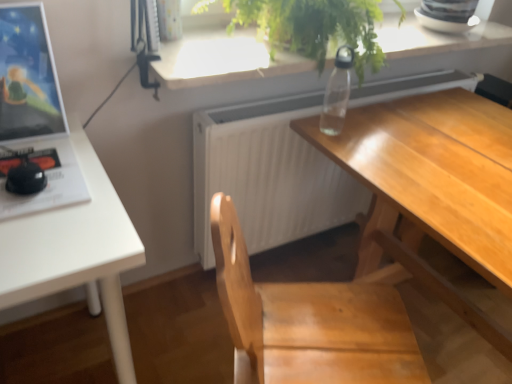
Locate an element on the screen. Image resolution: width=512 pixels, height=384 pixels. matte black monitor at left is located at coordinates tap(28, 76).

The width and height of the screenshot is (512, 384). What do you see at coordinates (28, 76) in the screenshot? I see `matte black monitor at left` at bounding box center [28, 76].

The height and width of the screenshot is (384, 512). What do you see at coordinates (337, 93) in the screenshot?
I see `transparent plastic bottle at upper center` at bounding box center [337, 93].

Where is `white matte radiator at center`? The height and width of the screenshot is (384, 512). white matte radiator at center is located at coordinates (268, 174).

Where is `green leafy plant at upper center`? The image size is (512, 384). green leafy plant at upper center is located at coordinates (314, 27).

Image resolution: width=512 pixels, height=384 pixels. I want to click on matte black monitor at left, so click(28, 76).

Can you confirm if matte black monitor at left is wider than white matte radiator at center?

Incorrect, the width of matte black monitor at left does not surpass that of white matte radiator at center.

How many degrees apart are the facing directions of matte black monitor at left and white matte radiator at center?

The angular difference between matte black monitor at left and white matte radiator at center is 3.69 degrees.

From the image's perspective, is matte black monitor at left positioned above or below white matte radiator at center?

Based on their image positions, matte black monitor at left is located above white matte radiator at center.

Does point (37, 92) appear closer or farther from the camera than point (266, 192)?

Point (37, 92).

Relative to green leafy plant at upper center, is white matte radiator at center in front or behind?

In the image, white matte radiator at center appears behind green leafy plant at upper center.

From a real-world perspective, is white matte radiator at center over green leafy plant at upper center?

No, from a real-world perspective, white matte radiator at center is not above green leafy plant at upper center.

Can you confirm if white matte radiator at center is positioned to the left of green leafy plant at upper center?

Incorrect, white matte radiator at center is not on the left side of green leafy plant at upper center.

Can we say white matte radiator at center lies outside green leafy plant at upper center?

That's correct, white matte radiator at center is outside of green leafy plant at upper center.

From the picture: From a real-world perspective, is wooden desk at center located higher than white matte radiator at center?

Yes, from a real-world perspective, wooden desk at center is above white matte radiator at center.

Is wooden desk at center wider than white matte radiator at center?

Indeed, wooden desk at center has a greater width compared to white matte radiator at center.

Considering the relative positions of wooden desk at center and white matte radiator at center in the image provided, is wooden desk at center to the right of white matte radiator at center from the viewer's perspective?

In fact, wooden desk at center is to the left of white matte radiator at center.

Considering the sizes of objects wooden desk at center and white matte radiator at center in the image provided, who is shorter, wooden desk at center or white matte radiator at center?

white matte radiator at center.

In the scene shown: From the image's perspective, between white matte radiator at center and white matte table at left, who is located below?

white matte table at left appears lower in the image.

Between white matte radiator at center and white matte table at left, which one appears on the left side from the viewer's perspective?

Positioned to the left is white matte table at left.

Between white matte radiator at center and white matte table at left, which one has smaller width?

With smaller width is white matte radiator at center.

From a real-world perspective, which is physically below, white matte radiator at center or white matte table at left?

white matte table at left.

Based on their positions, is matte black monitor at left located to the left or right of white matte table at left?

matte black monitor at left is to the left of white matte table at left.

Locate an element on the screen. The image size is (512, 384). table on the right of the matte black monitor at left is located at coordinates (76, 250).

Considering the relative sizes of matte black monitor at left and white matte table at left in the image provided, is matte black monitor at left wider than white matte table at left?

Incorrect, the width of matte black monitor at left does not surpass that of white matte table at left.

Based on the photo, which of these two, matte black monitor at left or white matte table at left, is smaller?

Smaller between the two is matte black monitor at left.

From a real-world perspective, which is physically below, wooden desk at center or transparent plastic bottle at upper center?

wooden desk at center is physically lower.

Could you tell me if wooden desk at center is turned towards transparent plastic bottle at upper center?

No, wooden desk at center is not aimed at transparent plastic bottle at upper center.

How many degrees apart are the facing directions of wooden desk at center and transparent plastic bottle at upper center?

59.5 degrees separate the facing orientations of wooden desk at center and transparent plastic bottle at upper center.

Where is `bottle that is behind the wooden desk at center`? The height and width of the screenshot is (384, 512). bottle that is behind the wooden desk at center is located at coordinates (337, 93).

Is the surface of white matte table at left in direct contact with green leafy plant at upper center?

No, white matte table at left is not with green leafy plant at upper center.

Does point (83, 142) come in front of point (227, 28)?

Yes, it is.

Can you confirm if white matte table at left is positioned to the right of green leafy plant at upper center?

No.

Does white matte table at left lie in front of green leafy plant at upper center?

Yes, white matte table at left is closer to the camera.

I want to click on radiator below the matte black monitor at left (from the image's perspective), so click(268, 174).

Find the location of a particular element. The height and width of the screenshot is (384, 512). radiator on the right of green leafy plant at upper center is located at coordinates (268, 174).

In the scene shown: Based on their spatial positions, is white matte radiator at center or transparent plastic bottle at upper center closer to matte black monitor at left?

white matte radiator at center.

Which object lies nearer to the anchor point wooden desk at center, white matte radiator at center or transparent plastic bottle at upper center?

Among the two, transparent plastic bottle at upper center is located nearer to wooden desk at center.

Based on their spatial positions, is matte black monitor at left or wooden desk at center closer to transparent plastic bottle at upper center?

wooden desk at center lies closer to transparent plastic bottle at upper center than the other object.

Looking at the image, which one is located closer to green leafy plant at upper center, white matte table at left or wooden desk at center?

The object closer to green leafy plant at upper center is wooden desk at center.

Based on their spatial positions, is matte black monitor at left or white matte table at left closer to transparent plastic bottle at upper center?

white matte table at left lies closer to transparent plastic bottle at upper center than the other object.

When comparing their distances from transparent plastic bottle at upper center, does white matte table at left or white matte radiator at center seem closer?

white matte radiator at center is closer to transparent plastic bottle at upper center.

Based on their spatial positions, is wooden desk at center or white matte radiator at center closer to green leafy plant at upper center?

wooden desk at center is positioned closer to the anchor green leafy plant at upper center.

Based on their spatial positions, is wooden desk at center or white matte table at left closer to transparent plastic bottle at upper center?

wooden desk at center is positioned closer to the anchor transparent plastic bottle at upper center.

Locate an element on the screen. The width and height of the screenshot is (512, 384). houseplant located between matte black monitor at left and transparent plastic bottle at upper center in the left-right direction is located at coordinates (314, 27).

Where is `computer monitor between green leafy plant at upper center and wooden desk at center in the up-down direction`? The height and width of the screenshot is (384, 512). computer monitor between green leafy plant at upper center and wooden desk at center in the up-down direction is located at coordinates (28, 76).

You are a GUI agent. You are given a task and a screenshot of the screen. Output one action in this format:
    pyautogui.click(x=<x>, y=<y>)
    Task: Click on the houseplant located between white matte table at left and white matte radiator at center in the left-right direction
    Image resolution: width=512 pixels, height=384 pixels.
    Given the screenshot: What is the action you would take?
    pyautogui.click(x=314, y=27)

You are a GUI agent. You are given a task and a screenshot of the screen. Output one action in this format:
    pyautogui.click(x=<x>, y=<y>)
    Task: Click on the houseplant between matte black monitor at left and white matte radiator at center in the horizontal direction
    Image resolution: width=512 pixels, height=384 pixels.
    Given the screenshot: What is the action you would take?
    pyautogui.click(x=314, y=27)